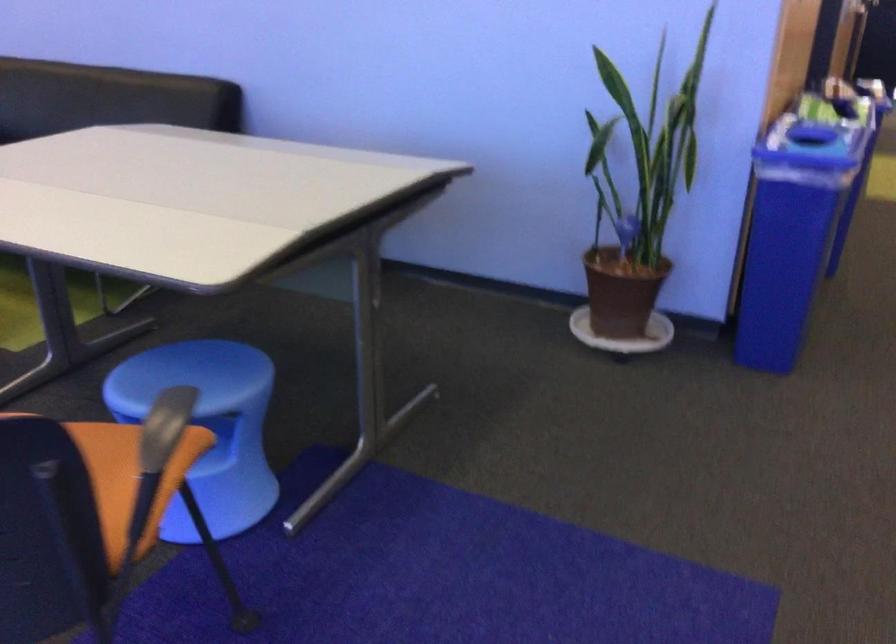
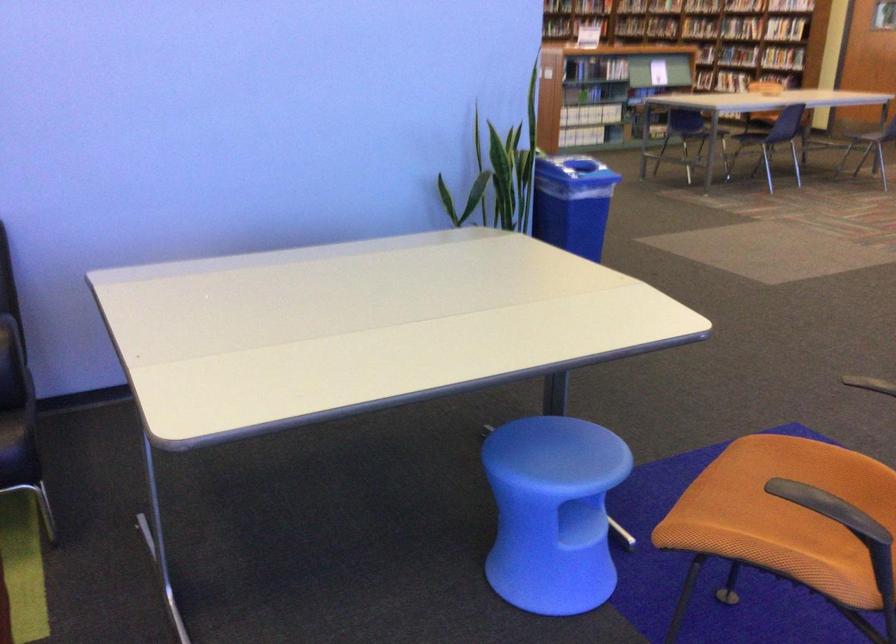
Where in the second image is the point corresponding to point 730,184 from the first image?

(572, 203)